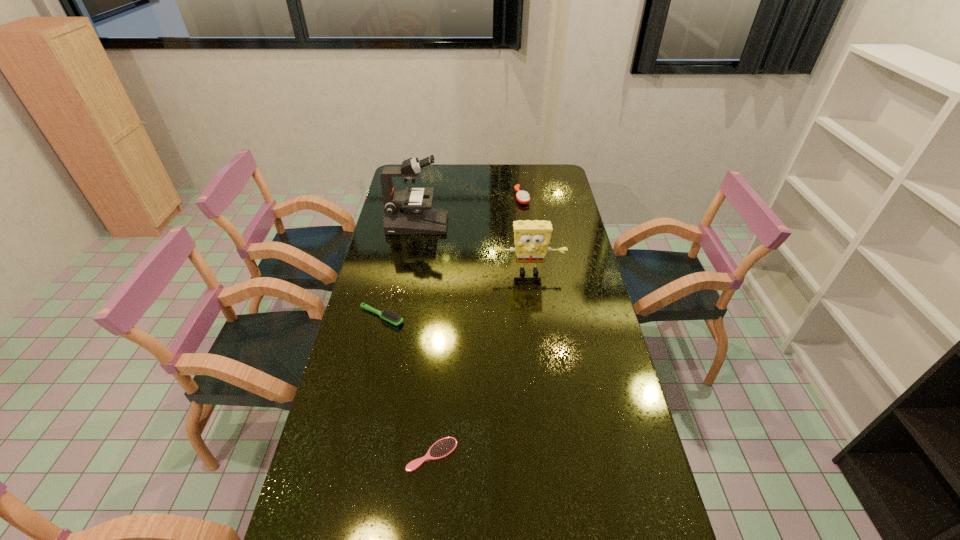
Identify the location of empty location between the leftmost hairbrush and the tallest object. (399, 271).

You are a GUI agent. You are given a task and a screenshot of the screen. Output one action in this format:
    pyautogui.click(x=<x>, y=<y>)
    Task: Click on the free space between the third nearest object and the nearest hairbrush
    Image resolution: width=960 pixels, height=540 pixels.
    Given the screenshot: What is the action you would take?
    pyautogui.click(x=480, y=363)

The image size is (960, 540). In order to click on vacant area between the second shortest object and the third farthest object in this screenshot , I will do `click(455, 294)`.

Where is `object that stands as the fourth closest to the sponge`? The image size is (960, 540). object that stands as the fourth closest to the sponge is located at coordinates (442, 448).

Point out which object is positioned as the second nearest to the second tallest object. Please provide its 2D coordinates. Your answer should be formatted as a tuple, i.e. [(x, y)], where the tuple contains the x and y coordinates of a point satisfying the conditions above.

[(389, 316)]

Select which hairbrush appears as the closest to the rightmost hairbrush. Please provide its 2D coordinates. Your answer should be formatted as a tuple, i.e. [(x, y)], where the tuple contains the x and y coordinates of a point satisfying the conditions above.

[(389, 316)]

Point out which hairbrush is positioned as the second nearest to the sponge. Please provide its 2D coordinates. Your answer should be formatted as a tuple, i.e. [(x, y)], where the tuple contains the x and y coordinates of a point satisfying the conditions above.

[(522, 197)]

You are a GUI agent. You are given a task and a screenshot of the screen. Output one action in this format:
    pyautogui.click(x=<x>, y=<y>)
    Task: Click on the vacant space that satisfies the following two spatial constraints: 1. on the front side of the farthest object; 2. through the eyepieces of the fourth nearest object
    This screenshot has width=960, height=540.
    Given the screenshot: What is the action you would take?
    pyautogui.click(x=525, y=225)

Find the location of a particular element. The width and height of the screenshot is (960, 540). free spot that satisfies the following two spatial constraints: 1. on the front side of the second hairbrush from left to right; 2. on the left side of the second tallest hairbrush is located at coordinates (350, 455).

At what (x,y) coordinates should I click in order to perform the action: click on blank area in the image that satisfies the following two spatial constraints: 1. through the eyepieces of the second farthest object; 2. on the back side of the nearest hairbrush. Please return your answer as a coordinate pair (x, y). The height and width of the screenshot is (540, 960). Looking at the image, I should click on (376, 455).